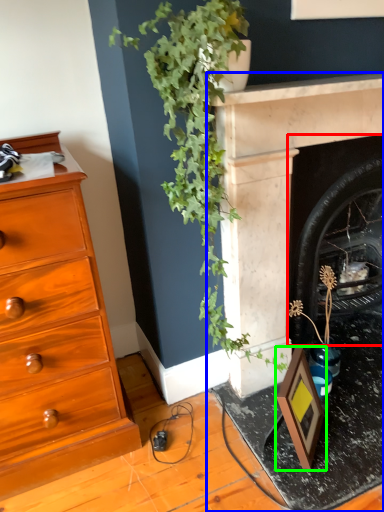
Question: Which object is the closest to the fireplace (highlighted by a red box)? Choose among these: fireplace (highlighted by a blue box) or picture frame (highlighted by a green box).

Choices:
 (A) fireplace
 (B) picture frame

Answer: (A)